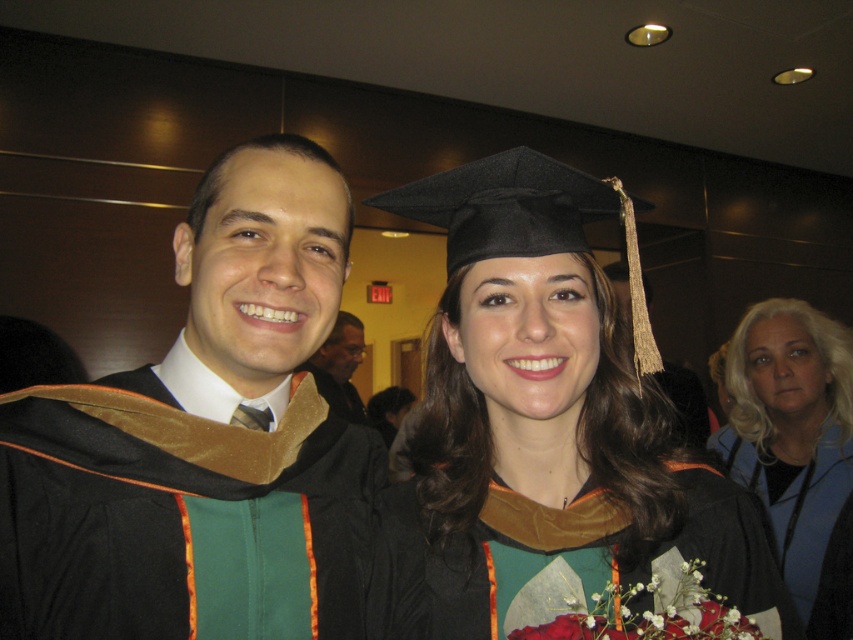
Question: Among these points, which one is nearest to the camera?

Choices:
 (A) (737, 381)
 (B) (579, 417)

Answer: (B)

Question: Can you confirm if velvet black graduation gown at center is positioned to the left of matte black graduation gown at center?

Choices:
 (A) no
 (B) yes

Answer: (A)

Question: Considering the relative positions of velvet-like black gown at center and blonde hair at upper right in the image provided, where is velvet-like black gown at center located with respect to blonde hair at upper right?

Choices:
 (A) below
 (B) above

Answer: (B)

Question: Which object appears farthest from the camera in this image?

Choices:
 (A) matte black graduation cap at center
 (B) matte black graduation gown at center
 (C) velvet-like black gown at center

Answer: (B)

Question: Does blonde hair at upper right appear under matte black graduation gown at center?

Choices:
 (A) yes
 (B) no

Answer: (A)

Question: Among these points, which one is farthest from the camera?

Choices:
 (A) (781, 570)
 (B) (329, 624)
 (C) (321, 384)
 (D) (572, 496)

Answer: (C)